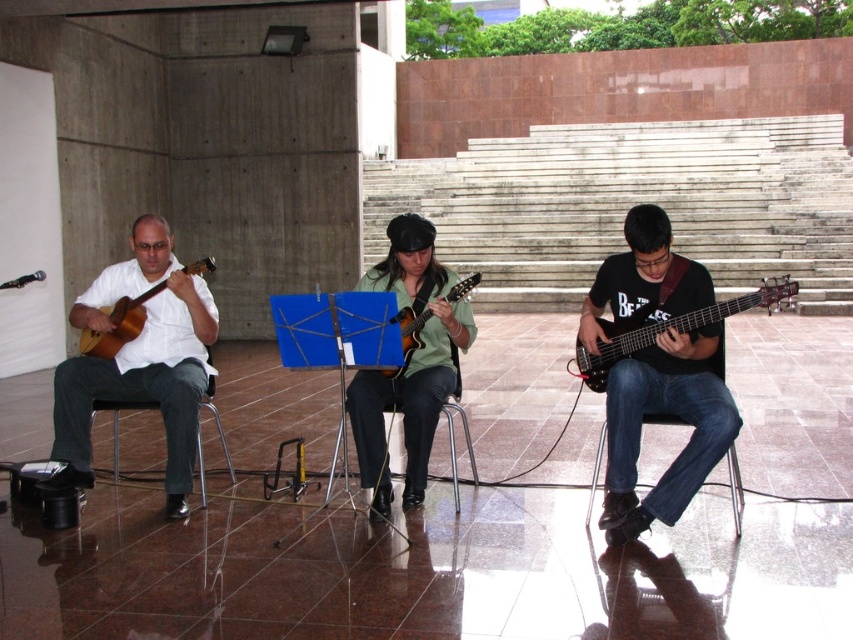
Who is higher up, shiny black electric guitar at center right or matte green guitar at center?

Positioned higher is matte green guitar at center.

Between shiny black electric guitar at center right and matte green guitar at center, which one appears on the right side from the viewer's perspective?

shiny black electric guitar at center right

You are a GUI agent. You are given a task and a screenshot of the screen. Output one action in this format:
    pyautogui.click(x=<x>, y=<y>)
    Task: Click on the shiny black electric guitar at center right
    The width and height of the screenshot is (853, 640).
    Given the screenshot: What is the action you would take?
    pyautogui.click(x=669, y=326)

The width and height of the screenshot is (853, 640). Identify the location of shiny black electric guitar at center right. (669, 326).

Who is lower down, shiny black electric guitar at center right or metallic silver chair at left?

metallic silver chair at left is lower down.

Is point (607, 324) more distant than point (119, 445)?

That is False.

This screenshot has height=640, width=853. What do you see at coordinates (669, 326) in the screenshot?
I see `shiny black electric guitar at center right` at bounding box center [669, 326].

In order to click on shiny black electric guitar at center right in this screenshot , I will do `click(669, 326)`.

Between black matte guitar at right and metallic silver chair at left, which one is positioned lower?

metallic silver chair at left is below.

Does black matte guitar at right have a smaller size compared to metallic silver chair at left?

No.

Who is more distant from viewer, (666, 301) or (212, 396)?

Point (212, 396)

Where is `black matte guitar at right`? Image resolution: width=853 pixels, height=640 pixels. black matte guitar at right is located at coordinates point(668,413).